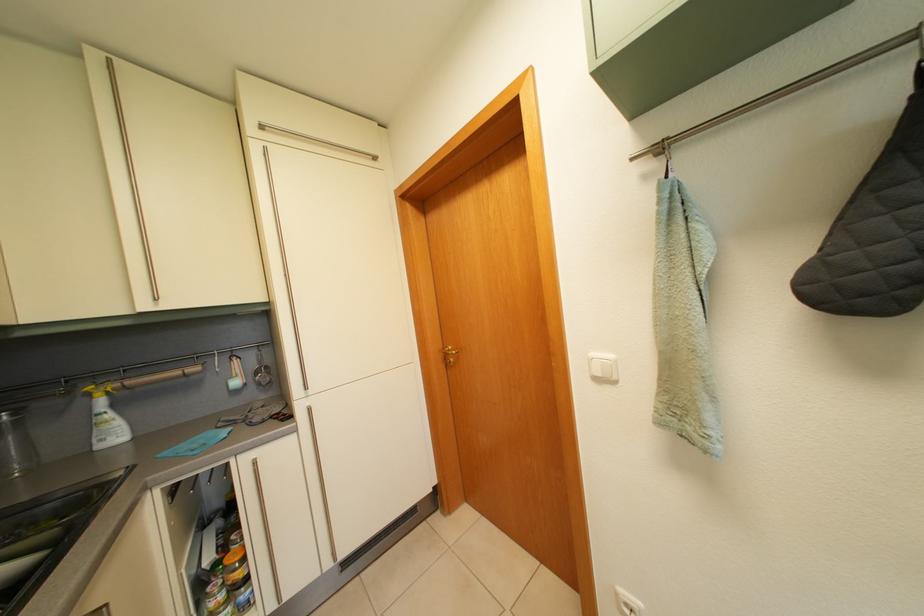
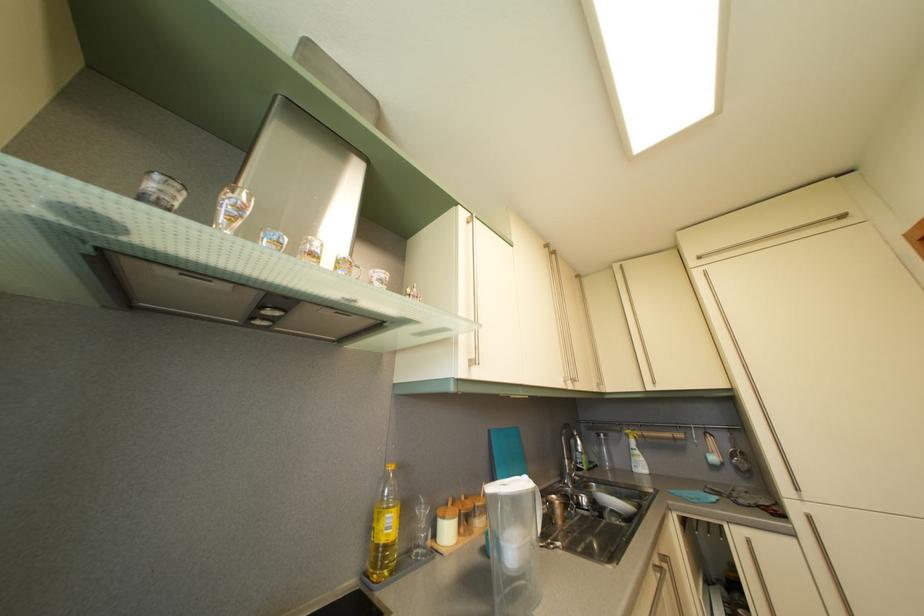
Where in the second image is the point corresponding to point (101, 62) from the first image?

(624, 274)